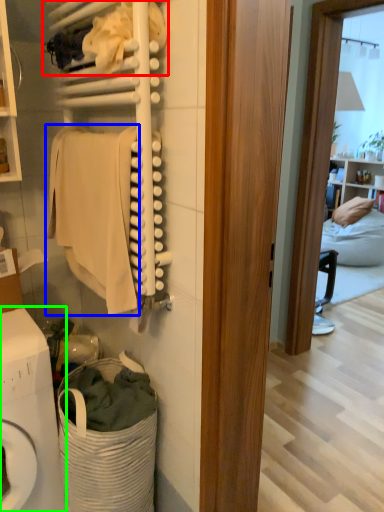
Question: Based on their relative distances, which object is farther from laundry (highlighted by a red box)? Choose from clothing (highlighted by a blue box) and washing machine (highlighted by a green box).

Choices:
 (A) clothing
 (B) washing machine

Answer: (B)